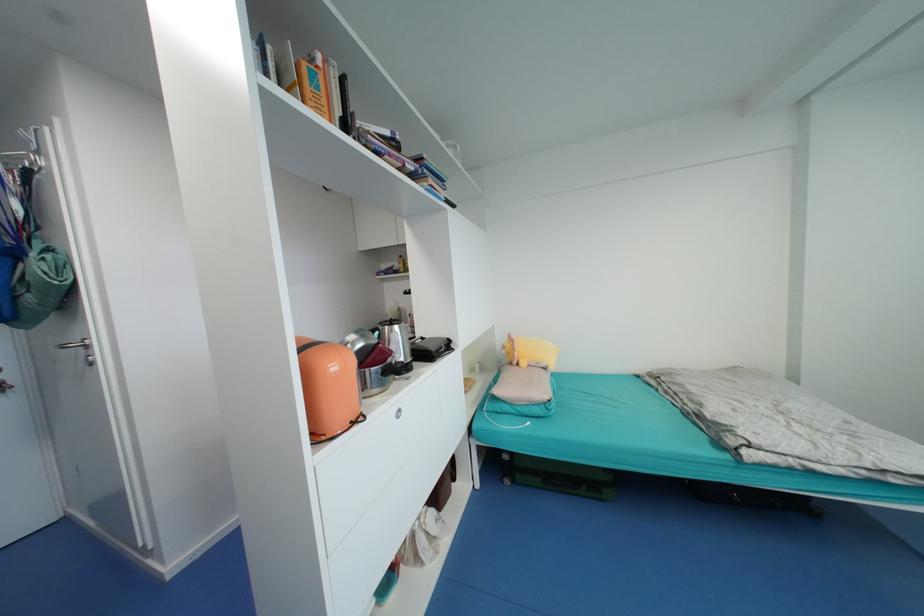
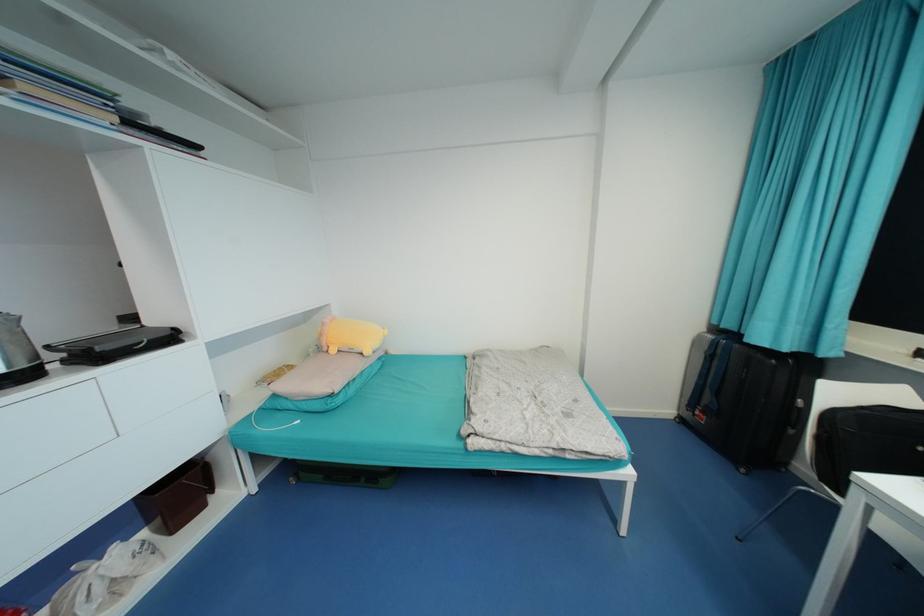
The point at (517,350) is marked in the first image. Where is the corresponding point in the second image?

(325, 334)